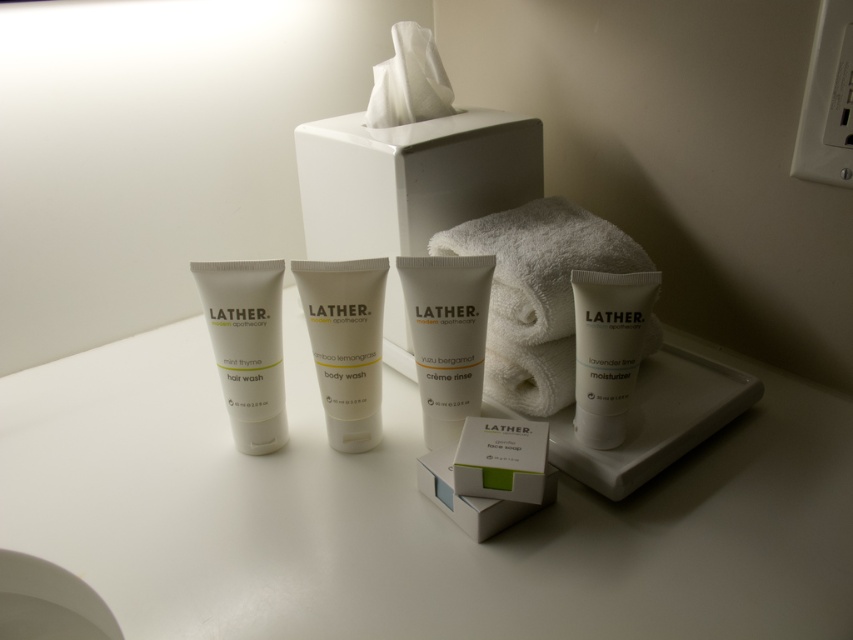
Is white soft towel at center shorter than white matte body wash at center?

Incorrect, white soft towel at center's height does not fall short of white matte body wash at center's.

Does white soft towel at center have a larger size compared to white matte body wash at center?

Yes, white soft towel at center is bigger than white matte body wash at center.

Is point (583, 209) behind point (335, 268)?

That is True.

I want to click on white soft towel at center, so click(537, 292).

Is white matte body wash at center to the left of white matte tube at left from the viewer's perspective?

No, white matte body wash at center is not to the left of white matte tube at left.

Can you confirm if white matte body wash at center is positioned above white matte tube at left?

Yes.

You are a GUI agent. You are given a task and a screenshot of the screen. Output one action in this format:
    pyautogui.click(x=<x>, y=<y>)
    Task: Click on the white matte body wash at center
    The image size is (853, 640).
    Given the screenshot: What is the action you would take?
    pyautogui.click(x=345, y=344)

Find the location of a particular element. This screenshot has height=640, width=853. white matte body wash at center is located at coordinates (345, 344).

Between point (438, 394) and point (471, 496), which one is positioned in front?

Point (471, 496) is more forward.

Is white matte creme rinse at center further to the viewer compared to white cardboard box at center?

Yes, it is behind white cardboard box at center.

Consider the image. Who is more distant from viewer, (422, 308) or (480, 486)?

The point (422, 308) is behind.

Locate an element on the screen. The height and width of the screenshot is (640, 853). white matte creme rinse at center is located at coordinates click(445, 337).